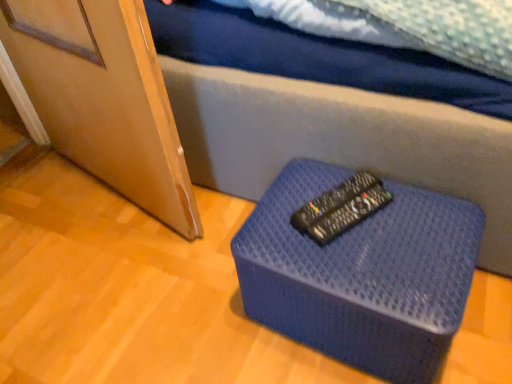
Question: Is blue textured ottoman at center bigger than black plastic remote at center?

Choices:
 (A) yes
 (B) no

Answer: (A)

Question: Is black plastic remote at center a part of blue textured ottoman at center?

Choices:
 (A) yes
 (B) no

Answer: (B)

Question: Can you confirm if blue textured ottoman at center is positioned to the right of black plastic remote at center?

Choices:
 (A) no
 (B) yes

Answer: (B)

Question: Can you confirm if blue textured ottoman at center is smaller than black plastic remote at center?

Choices:
 (A) yes
 (B) no

Answer: (B)

Question: Does blue textured ottoman at center have a greater height compared to black plastic remote at center?

Choices:
 (A) yes
 (B) no

Answer: (A)

Question: Is blue textured ottoman at center turned away from black plastic remote at center?

Choices:
 (A) yes
 (B) no

Answer: (B)

Question: Can you confirm if black plastic remote at center is taller than blue textured ottoman at center?

Choices:
 (A) no
 (B) yes

Answer: (A)

Question: Does black plastic remote at center turn towards blue textured ottoman at center?

Choices:
 (A) no
 (B) yes

Answer: (A)

Question: Is black plastic remote at center touching blue textured ottoman at center?

Choices:
 (A) no
 (B) yes

Answer: (A)

Question: Does black plastic remote at center have a greater width compared to blue textured ottoman at center?

Choices:
 (A) yes
 (B) no

Answer: (B)

Question: From a real-world perspective, is black plastic remote at center beneath blue textured ottoman at center?

Choices:
 (A) yes
 (B) no

Answer: (B)

Question: Considering the relative sizes of black plastic remote at center and blue textured ottoman at center in the image provided, is black plastic remote at center thinner than blue textured ottoman at center?

Choices:
 (A) yes
 (B) no

Answer: (A)

Question: From their relative heights in the image, would you say blue textured ottoman at center is taller or shorter than black plastic remote at center?

Choices:
 (A) tall
 (B) short

Answer: (A)